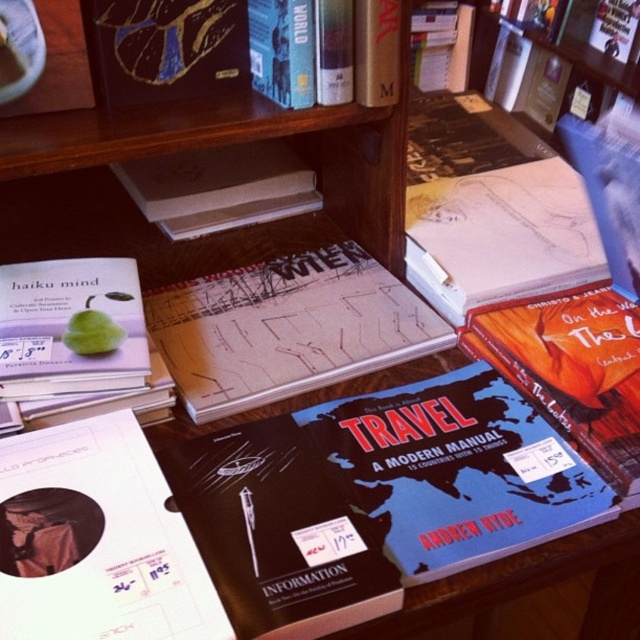
Question: Which point appears closest to the camera in this image?

Choices:
 (A) click(284, 196)
 (B) click(301, 508)
 (C) click(349, 253)
 (D) click(140, 29)

Answer: (B)

Question: Is blue matte travel guide at center bigger than white matte book at lower left?

Choices:
 (A) yes
 (B) no

Answer: (A)

Question: In this image, where is blue matte travel guide at center located relative to gold foil notebook at upper left?

Choices:
 (A) right
 (B) left

Answer: (A)

Question: Which is nearer to the white matte book at lower left?

Choices:
 (A) blue matte travel guide at center
 (B) white paper notebook at center
 (C) black matte travel guide at center
 (D) white matte book at center

Answer: (C)

Question: Estimate the real-world distances between objects in this image. Which object is closer to the blue matte travel guide at center?

Choices:
 (A) white paper notebook at center
 (B) black matte travel guide at center

Answer: (B)

Question: Is white matte book at lower left thinner than black matte travel guide at center?

Choices:
 (A) yes
 (B) no

Answer: (B)